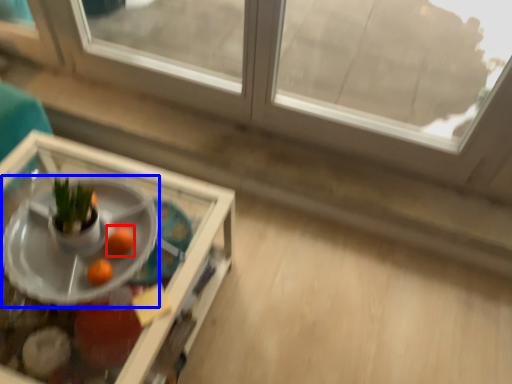
Question: Which point is further to the camera, orange (highlighted by a red box) or table (highlighted by a blue box)?

Choices:
 (A) orange
 (B) table

Answer: (A)